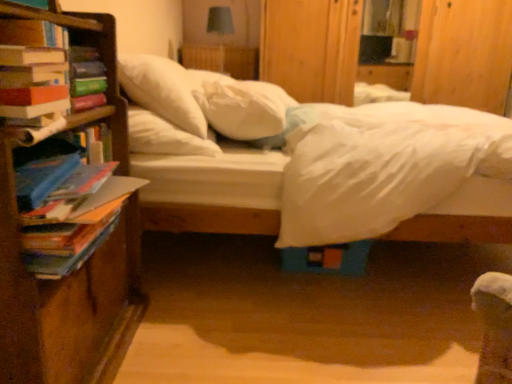
Question: Is white soft pillow at center, arranged as the 1th pillow when viewed from the left, in front of or behind multicolored paper book at left, the second book viewed from the top, in the image?

Choices:
 (A) front
 (B) behind

Answer: (B)

Question: Considering the relative positions of white soft pillow at center, arranged as the 1th pillow when viewed from the left, and multicolored paper book at left, the second book viewed from the top, in the image provided, is white soft pillow at center, arranged as the 1th pillow when viewed from the left, to the left or to the right of multicolored paper book at left, the second book viewed from the top,?

Choices:
 (A) right
 (B) left

Answer: (A)

Question: Which is nearer to the hardcover book at left, positioned as the second book in bottom-to-top order?

Choices:
 (A) wooden bookcase at left
 (B) white soft pillow at center, positioned as the 2th pillow in left-to-right order
 (C) white soft pillow at center, the 2th pillow when ordered from right to left
 (D) white soft bed at center
 (E) blue fabric lampshade at upper center

Answer: (A)

Question: Which object is positioned closest to the multicolored paper book at left, the second book viewed from the top?

Choices:
 (A) white soft pillow at center, positioned as the 2th pillow in left-to-right order
 (B) white soft bed at center
 (C) blue fabric lampshade at upper center
 (D) hardcover book at left, which is the first book from top to bottom
 (E) white soft pillow at center, the 2th pillow when ordered from right to left

Answer: (D)